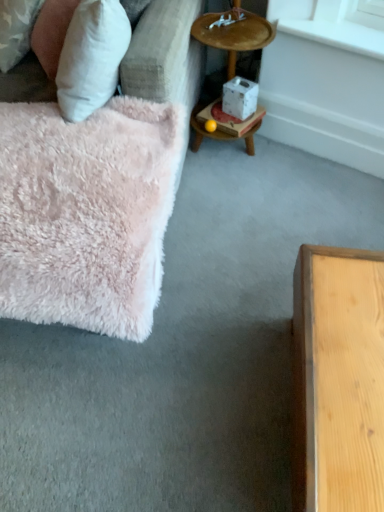
Where is `free point above white cardboard box at center (from a real-world perspective)`? This screenshot has height=512, width=384. free point above white cardboard box at center (from a real-world perspective) is located at coordinates (234, 113).